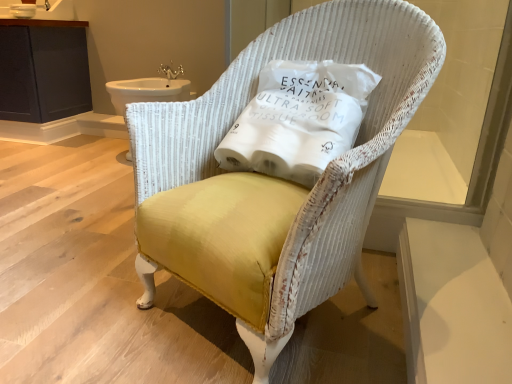
What do you see at coordinates (298, 119) in the screenshot?
I see `white fabric pillow at center` at bounding box center [298, 119].

Measure the distance between gold metallic faucet at upper center and camera.

gold metallic faucet at upper center and camera are 2.51 meters apart.

Locate an element on the screen. The width and height of the screenshot is (512, 384). white ceramic sink at upper left is located at coordinates click(55, 10).

Is yellow fabric chair at center shorter than white ceramic sink at upper left?

Incorrect, the height of yellow fabric chair at center does not fall short of that of white ceramic sink at upper left.

Can you confirm if yellow fabric chair at center is bigger than white ceramic sink at upper left?

Indeed, yellow fabric chair at center has a larger size compared to white ceramic sink at upper left.

Between yellow fabric chair at center and white ceramic sink at upper left, which one is positioned behind?

Positioned behind is white ceramic sink at upper left.

Find the location of a particular element. This screenshot has width=512, height=384. faucet lying on the right of dark gray wood cabinet at upper left is located at coordinates (170, 71).

From a real-world perspective, relative to gold metallic faucet at upper center, is dark gray wood cabinet at upper left vertically above or below?

dark gray wood cabinet at upper left is below gold metallic faucet at upper center.

Considering the sizes of objects dark gray wood cabinet at upper left and gold metallic faucet at upper center in the image provided, who is smaller, dark gray wood cabinet at upper left or gold metallic faucet at upper center?

With smaller size is gold metallic faucet at upper center.

Does dark gray wood cabinet at upper left come behind gold metallic faucet at upper center?

No.

Is yellow fabric chair at center taller than dark gray wood cabinet at upper left?

Indeed, yellow fabric chair at center has a greater height compared to dark gray wood cabinet at upper left.

Do you think yellow fabric chair at center is within dark gray wood cabinet at upper left, or outside of it?

yellow fabric chair at center is located beyond the bounds of dark gray wood cabinet at upper left.

At what (x,y) coordinates should I click in order to perform the action: click on cabinetry behind the yellow fabric chair at center. Please return your answer as a coordinate pair (x, y). The width and height of the screenshot is (512, 384). Looking at the image, I should click on (44, 72).

Considering the relative positions of yellow fabric chair at center and dark gray wood cabinet at upper left in the image provided, is yellow fabric chair at center to the right of dark gray wood cabinet at upper left from the viewer's perspective?

Indeed, yellow fabric chair at center is positioned on the right side of dark gray wood cabinet at upper left.

Are dark gray wood cabinet at upper left and white ceramic sink at upper left located far from each other?

Actually, dark gray wood cabinet at upper left and white ceramic sink at upper left are a little close together.

From the image's perspective, does dark gray wood cabinet at upper left appear higher than white ceramic sink at upper left?

No, from the image's perspective, dark gray wood cabinet at upper left is not above white ceramic sink at upper left.

Find the location of a particular element. sink lying on the right of dark gray wood cabinet at upper left is located at coordinates (55, 10).

Could you tell me if dark gray wood cabinet at upper left is turned towards white ceramic sink at upper left?

No, dark gray wood cabinet at upper left is not facing towards white ceramic sink at upper left.

Does gold metallic faucet at upper center turn towards white ceramic sink at upper left?

No.

From the image's perspective, is gold metallic faucet at upper center below white ceramic sink at upper left?

Correct, gold metallic faucet at upper center appears lower than white ceramic sink at upper left in the image.

Is the depth of gold metallic faucet at upper center less than that of white ceramic sink at upper left?

No.

From a real-world perspective, which is physically above, gold metallic faucet at upper center or white ceramic sink at upper left?

In real-world perspective, white ceramic sink at upper left is above.

Is gold metallic faucet at upper center further to the viewer compared to white fabric pillow at center?

That is True.

From the image's perspective, is gold metallic faucet at upper center under white fabric pillow at center?

Actually, gold metallic faucet at upper center appears above white fabric pillow at center in the image.

Does point (160, 73) come behind point (263, 159)?

Yes, it is.

Does gold metallic faucet at upper center touch white fabric pillow at center?

gold metallic faucet at upper center and white fabric pillow at center are clearly separated.

From a real-world perspective, which is physically above, dark gray wood cabinet at upper left or yellow fabric chair at center?

dark gray wood cabinet at upper left is physically above.

Considering the sizes of objects dark gray wood cabinet at upper left and yellow fabric chair at center in the image provided, who is wider, dark gray wood cabinet at upper left or yellow fabric chair at center?

yellow fabric chair at center is wider.

Considering the sizes of objects dark gray wood cabinet at upper left and yellow fabric chair at center in the image provided, who is taller, dark gray wood cabinet at upper left or yellow fabric chair at center?

yellow fabric chair at center is taller.

Is dark gray wood cabinet at upper left turned away from yellow fabric chair at center?

No, dark gray wood cabinet at upper left's orientation is not away from yellow fabric chair at center.

You are a GUI agent. You are given a task and a screenshot of the screen. Output one action in this format:
    pyautogui.click(x=<x>, y=<y>)
    Task: Click on the sink lying behind the yellow fabric chair at center
    The image size is (512, 384).
    Given the screenshot: What is the action you would take?
    pyautogui.click(x=55, y=10)

The image size is (512, 384). What are the coordinates of `cabinetry below the gold metallic faucet at upper center (from a real-world perspective)` in the screenshot? It's located at (44, 72).

Based on their spatial positions, is white fabric pillow at center or yellow fabric chair at center closer to dark gray wood cabinet at upper left?

white fabric pillow at center.

Which object lies nearer to the anchor point white fabric pillow at center, dark gray wood cabinet at upper left or white ceramic sink at upper left?

Among the two, dark gray wood cabinet at upper left is located nearer to white fabric pillow at center.

Which object lies further to the anchor point dark gray wood cabinet at upper left, gold metallic faucet at upper center or white ceramic sink at upper left?

Based on the image, gold metallic faucet at upper center appears to be further to dark gray wood cabinet at upper left.

From the image, which object appears to be farther from white fabric pillow at center, white ceramic sink at upper left or dark gray wood cabinet at upper left?

white ceramic sink at upper left.

Estimate the real-world distances between objects in this image. Which object is closer to white ceramic sink at upper left, gold metallic faucet at upper center or yellow fabric chair at center?

Based on the image, gold metallic faucet at upper center appears to be nearer to white ceramic sink at upper left.

When comparing their distances from dark gray wood cabinet at upper left, does yellow fabric chair at center or gold metallic faucet at upper center seem closer?

Based on the image, gold metallic faucet at upper center appears to be nearer to dark gray wood cabinet at upper left.

Estimate the real-world distances between objects in this image. Which object is closer to dark gray wood cabinet at upper left, white fabric pillow at center or white ceramic sink at upper left?

white ceramic sink at upper left lies closer to dark gray wood cabinet at upper left than the other object.

Looking at the image, which one is located closer to dark gray wood cabinet at upper left, gold metallic faucet at upper center or white fabric pillow at center?

gold metallic faucet at upper center is positioned closer to the anchor dark gray wood cabinet at upper left.

The image size is (512, 384). Identify the location of sink between yellow fabric chair at center and dark gray wood cabinet at upper left in the front-back direction. (55, 10).

Find the location of a particular element. This screenshot has height=384, width=512. sink between white fabric pillow at center and gold metallic faucet at upper center along the z-axis is located at coordinates (55, 10).

This screenshot has width=512, height=384. Find the location of `sink situated between dark gray wood cabinet at upper left and white fabric pillow at center from left to right`. sink situated between dark gray wood cabinet at upper left and white fabric pillow at center from left to right is located at coordinates coord(55,10).

Where is `pillow between yellow fabric chair at center and gold metallic faucet at upper center from front to back`? pillow between yellow fabric chair at center and gold metallic faucet at upper center from front to back is located at coordinates (298, 119).